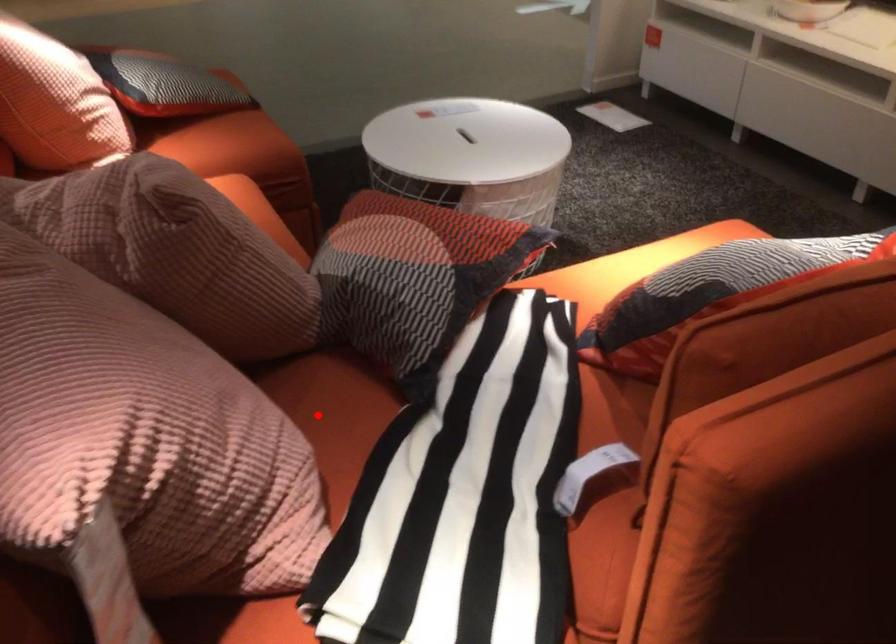
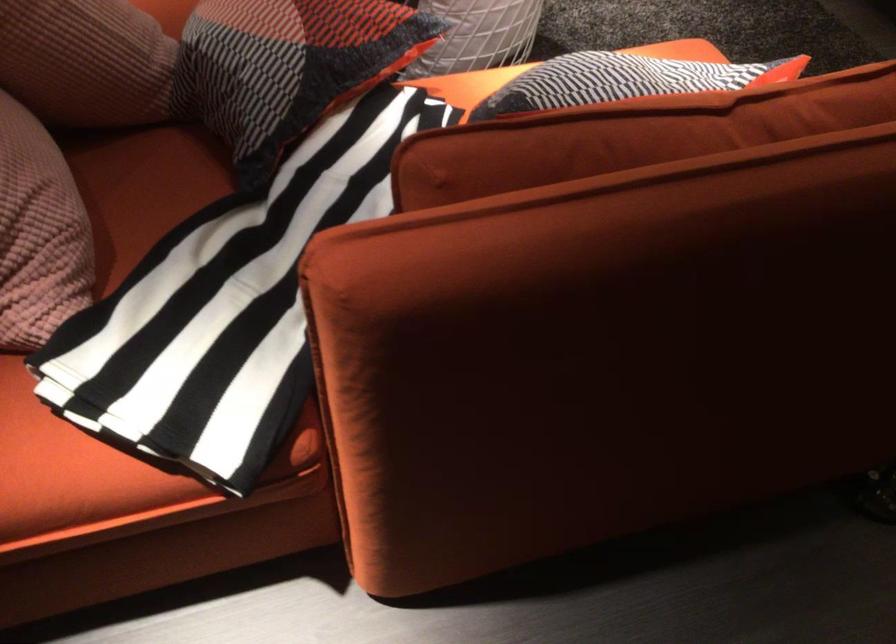
Where in the second image is the point corresponding to the highlighted location from the first image?

(142, 187)